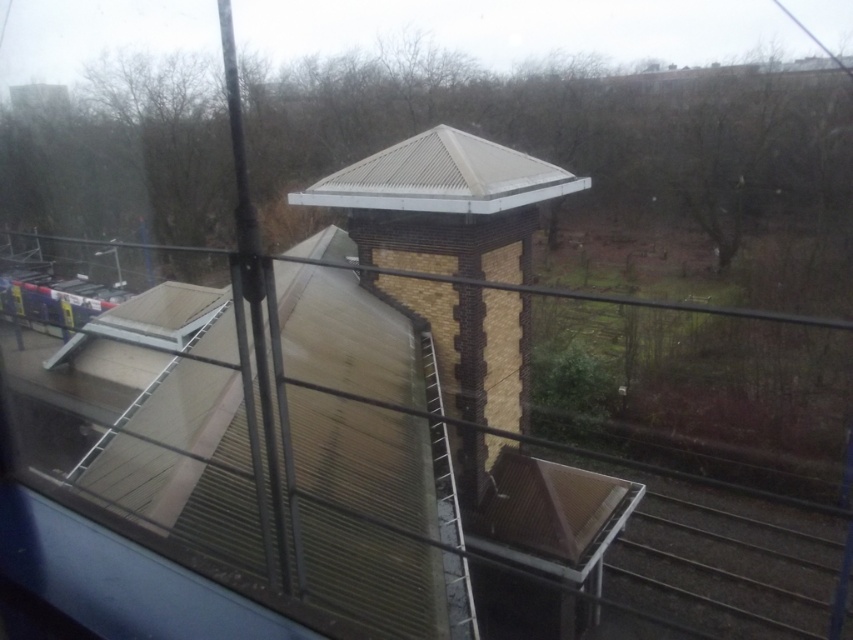
Question: Where is brick gazebo at center located in relation to metallic corrugated roof at center in the image?

Choices:
 (A) right
 (B) left

Answer: (A)

Question: Which of the following is the farthest from the observer?

Choices:
 (A) metallic corrugated roof at center
 (B) brick gazebo at center

Answer: (A)

Question: Among these points, which one is farthest from the camera?

Choices:
 (A) (451, 285)
 (B) (480, 145)

Answer: (B)

Question: Is brick gazebo at center bigger than metallic corrugated roof at center?

Choices:
 (A) no
 (B) yes

Answer: (B)

Question: Does brick gazebo at center appear over metallic corrugated roof at center?

Choices:
 (A) yes
 (B) no

Answer: (B)